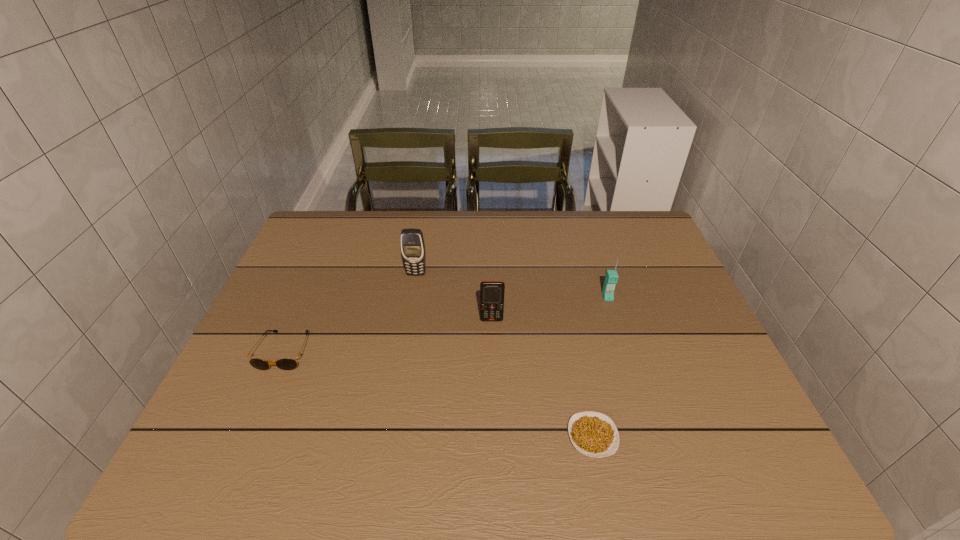
The image size is (960, 540). Find the location of `free space that is in between the nearest cellular telephone and the rightmost object`. free space that is in between the nearest cellular telephone and the rightmost object is located at coordinates (549, 308).

Identify the location of empty location between the second farthest cellular telephone and the leftmost cellular telephone. This screenshot has width=960, height=540. (512, 285).

Locate which object is the closest to the second object from left to right. Please provide its 2D coordinates. Your answer should be formatted as a tuple, i.e. [(x, y)], where the tuple contains the x and y coordinates of a point satisfying the conditions above.

[(491, 292)]

Identify which object is the third nearest to the nearest cellular telephone. Please provide its 2D coordinates. Your answer should be formatted as a tuple, i.e. [(x, y)], where the tuple contains the x and y coordinates of a point satisfying the conditions above.

[(593, 434)]

This screenshot has height=540, width=960. Identify the location of cellular telephone that is the closest to the second nearest cellular telephone. (491, 292).

Where is `cellular telephone that is the closest to the rightmost object`? The width and height of the screenshot is (960, 540). cellular telephone that is the closest to the rightmost object is located at coordinates (491, 292).

You are a GUI agent. You are given a task and a screenshot of the screen. Output one action in this format:
    pyautogui.click(x=<x>, y=<y>)
    Task: Click on the vacant region that satisfies the following two spatial constraints: 1. on the front face of the nearest object; 2. on the left side of the fourth object from right to left
    Image resolution: width=960 pixels, height=540 pixels.
    Given the screenshot: What is the action you would take?
    pyautogui.click(x=389, y=436)